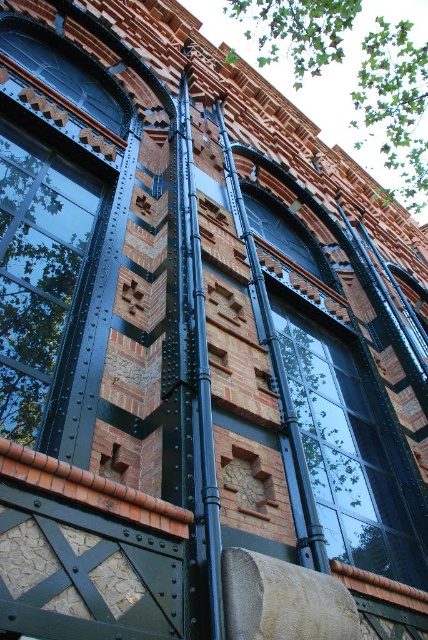
Question: Does matte black window at left have a lesser width compared to matte black glass window at center?

Choices:
 (A) no
 (B) yes

Answer: (A)

Question: Among these points, which one is nearest to the camera?

Choices:
 (A) (336, 362)
 (B) (15, 368)

Answer: (B)

Question: Can you confirm if matte black window at left is positioned to the left of matte black glass window at center?

Choices:
 (A) yes
 (B) no

Answer: (A)

Question: Which point appears closest to the camera in this image?

Choices:
 (A) (193, 186)
 (B) (302, 436)
 (C) (68, 186)

Answer: (B)

Question: Which object appears closest to the camera in this image?

Choices:
 (A) matte black window at left
 (B) black metal pole at center
 (C) matte black glass window at center

Answer: (B)

Question: Can you confirm if matte black glass window at center is positioned above black metal pole at center?

Choices:
 (A) yes
 (B) no

Answer: (B)